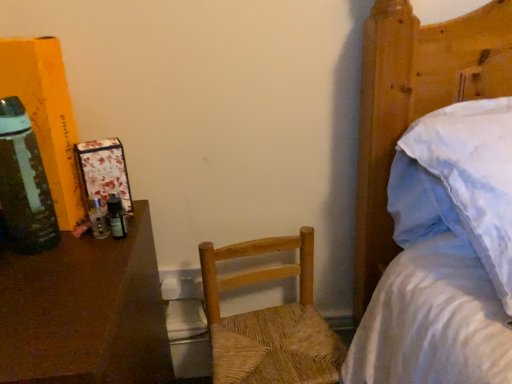
This screenshot has height=384, width=512. What do you see at coordinates (269, 321) in the screenshot? I see `woven wood chair at center` at bounding box center [269, 321].

Where is `green glass bottle at left`? Image resolution: width=512 pixels, height=384 pixels. green glass bottle at left is located at coordinates click(x=24, y=183).

Measure the distance between point (x=384, y=72) and camera.

Point (x=384, y=72) and camera are 81.00 centimeters apart.

At what (x,y) coordinates should I click in order to perform the action: click on white cotton bed at upper right. Please return your answer as a coordinate pair (x, y). Image resolution: width=512 pixels, height=384 pixels. Looking at the image, I should click on (415, 103).

Locate an element on the screen. Image resolution: width=512 pixels, height=384 pixels. brown polished wood desk at left is located at coordinates click(85, 312).

Would you consider white cotton bed at upper right to be distant from green glass bottle at left?

No, white cotton bed at upper right is in close proximity to green glass bottle at left.

Considering the sizes of objects white cotton bed at upper right and green glass bottle at left in the image provided, who is shorter, white cotton bed at upper right or green glass bottle at left?

green glass bottle at left is shorter.

Considering the relative sizes of white cotton bed at upper right and green glass bottle at left in the image provided, is white cotton bed at upper right bigger than green glass bottle at left?

Yes, white cotton bed at upper right is bigger than green glass bottle at left.

Considering the positions of objects white cotton bed at upper right and green glass bottle at left in the image provided, who is more to the right, white cotton bed at upper right or green glass bottle at left?

Positioned to the right is white cotton bed at upper right.

Can you confirm if brown polished wood desk at left is bigger than white cotton bed at upper right?

Actually, brown polished wood desk at left might be smaller than white cotton bed at upper right.

Consider the image. Is brown polished wood desk at left to the right of white cotton bed at upper right from the viewer's perspective?

In fact, brown polished wood desk at left is to the left of white cotton bed at upper right.

From the image's perspective, does brown polished wood desk at left appear higher than white cotton bed at upper right?

No.

From the picture: Is white cotton bed at upper right at the back of brown polished wood desk at left?

brown polished wood desk at left does not have its back to white cotton bed at upper right.

Is point (327, 329) behind point (5, 196)?

Yes, point (327, 329) is behind point (5, 196).

Measure the distance from woven wood chair at center to green glass bottle at left.

woven wood chair at center and green glass bottle at left are 18.04 inches apart.

In the image, there is a woven wood chair at center. Where is `bottle above it (from the image's perspective)`? bottle above it (from the image's perspective) is located at coordinates (24, 183).

Would you say woven wood chair at center is outside green glass bottle at left?

Yes, woven wood chair at center is located beyond the bounds of green glass bottle at left.

Does point (55, 249) appear closer or farther from the camera than point (20, 137)?

Point (55, 249) is farther from the camera than point (20, 137).

Can you confirm if brown polished wood desk at left is positioned to the right of green glass bottle at left?

No, brown polished wood desk at left is not to the right of green glass bottle at left.

Is brown polished wood desk at left surrounding green glass bottle at left?

No, brown polished wood desk at left does not contain green glass bottle at left.

Locate an element on the screen. The height and width of the screenshot is (384, 512). bottle above the brown polished wood desk at left (from a real-world perspective) is located at coordinates [24, 183].

Looking at this image, between woven wood chair at center and brown polished wood desk at left, which one has larger width?

Wider between the two is brown polished wood desk at left.

Is woven wood chair at center bigger than brown polished wood desk at left?

No.

Is brown polished wood desk at left at the back of woven wood chair at center?

No, woven wood chair at center's orientation is not away from brown polished wood desk at left.

Which is closer, (302,358) or (76,330)?

Point (302,358).

Is white cotton bed at upper right closer to camera compared to woven wood chair at center?

Yes, it is.

Is white cotton bed at upper right oriented towards woven wood chair at center?

No, white cotton bed at upper right is not turned towards woven wood chair at center.

Does white cotton bed at upper right have a greater height compared to woven wood chair at center?

Yes.

Measure the distance from white cotton bed at upper right to woven wood chair at center.

A distance of 11.22 inches exists between white cotton bed at upper right and woven wood chair at center.

Is green glass bottle at left not close to white cotton bed at upper right?

No, green glass bottle at left is not far from white cotton bed at upper right.

Image resolution: width=512 pixels, height=384 pixels. Identify the location of bottle lying above the white cotton bed at upper right (from the image's perspective). (24, 183).

Considering the positions of point (53, 212) and point (432, 79), is point (53, 212) closer or farther from the camera than point (432, 79)?

Point (53, 212) is closer to the camera than point (432, 79).

The width and height of the screenshot is (512, 384). Find the location of `bottle lying behind the white cotton bed at upper right`. bottle lying behind the white cotton bed at upper right is located at coordinates (24, 183).

Find the location of a particular element. The height and width of the screenshot is (384, 512). bed to the right of brown polished wood desk at left is located at coordinates (415, 103).

Estimate the real-world distances between objects in this image. Which object is further from brown polished wood desk at left, woven wood chair at center or green glass bottle at left?

woven wood chair at center is positioned further to the anchor brown polished wood desk at left.

From the image, which object appears to be nearer to white cotton bed at upper right, green glass bottle at left or brown polished wood desk at left?

Among the two, brown polished wood desk at left is located nearer to white cotton bed at upper right.

When comparing their distances from brown polished wood desk at left, does woven wood chair at center or white cotton bed at upper right seem closer?

Based on the image, woven wood chair at center appears to be nearer to brown polished wood desk at left.

Estimate the real-world distances between objects in this image. Which object is further from white cotton bed at upper right, green glass bottle at left or woven wood chair at center?

green glass bottle at left is positioned further to the anchor white cotton bed at upper right.

Based on the photo, based on their spatial positions, is brown polished wood desk at left or white cotton bed at upper right closer to green glass bottle at left?

The object closer to green glass bottle at left is brown polished wood desk at left.

From the image, which object appears to be farther from woven wood chair at center, brown polished wood desk at left or white cotton bed at upper right?

white cotton bed at upper right is further to woven wood chair at center.

Based on their spatial positions, is white cotton bed at upper right or woven wood chair at center closer to brown polished wood desk at left?

The object closer to brown polished wood desk at left is woven wood chair at center.

Considering their positions, is brown polished wood desk at left positioned further to green glass bottle at left than woven wood chair at center?

woven wood chair at center.

Locate an element on the screen. This screenshot has height=384, width=512. chair between brown polished wood desk at left and white cotton bed at upper right is located at coordinates (269, 321).

This screenshot has width=512, height=384. Identify the location of chair between green glass bottle at left and white cotton bed at upper right. (269, 321).

Find the location of `bottle between brown polished wood desk at left and woven wood chair at center in the horizontal direction`. bottle between brown polished wood desk at left and woven wood chair at center in the horizontal direction is located at coordinates (24, 183).

At what (x,y) coordinates should I click in order to perform the action: click on bottle between brown polished wood desk at left and white cotton bed at upper right. Please return your answer as a coordinate pair (x, y). Image resolution: width=512 pixels, height=384 pixels. Looking at the image, I should click on [x=24, y=183].